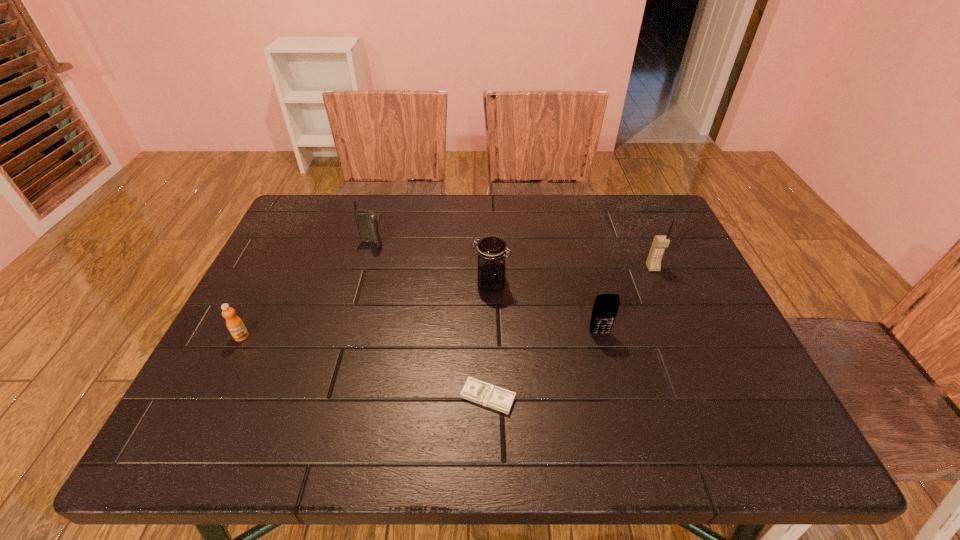
Image resolution: width=960 pixels, height=540 pixels. In order to click on object that is at the near edge in this screenshot , I will do `click(474, 390)`.

Find the location of a particular element. The height and width of the screenshot is (540, 960). object situated at the left edge is located at coordinates (235, 325).

Find the location of a particular element. This screenshot has width=960, height=540. object located at the right edge is located at coordinates (660, 242).

The height and width of the screenshot is (540, 960). In the image, there is a desktop. Identify the location of free space at the far edge. (542, 223).

I want to click on vacant space at the near edge of the desktop, so click(367, 446).

The height and width of the screenshot is (540, 960). I want to click on vacant space at the left edge, so click(x=279, y=275).

Where is `vacant space at the far left corner of the desktop`? The height and width of the screenshot is (540, 960). vacant space at the far left corner of the desktop is located at coordinates (310, 227).

Find the location of a particular element. The height and width of the screenshot is (540, 960). vacant space at the near right corner of the desktop is located at coordinates (780, 421).

Where is `vacant region between the third farthest object and the leftmost cellular telephone`? The width and height of the screenshot is (960, 540). vacant region between the third farthest object and the leftmost cellular telephone is located at coordinates (431, 264).

Locate an element on the screen. This screenshot has width=960, height=540. free space between the nearest cellular telephone and the orange juice is located at coordinates pos(420,335).